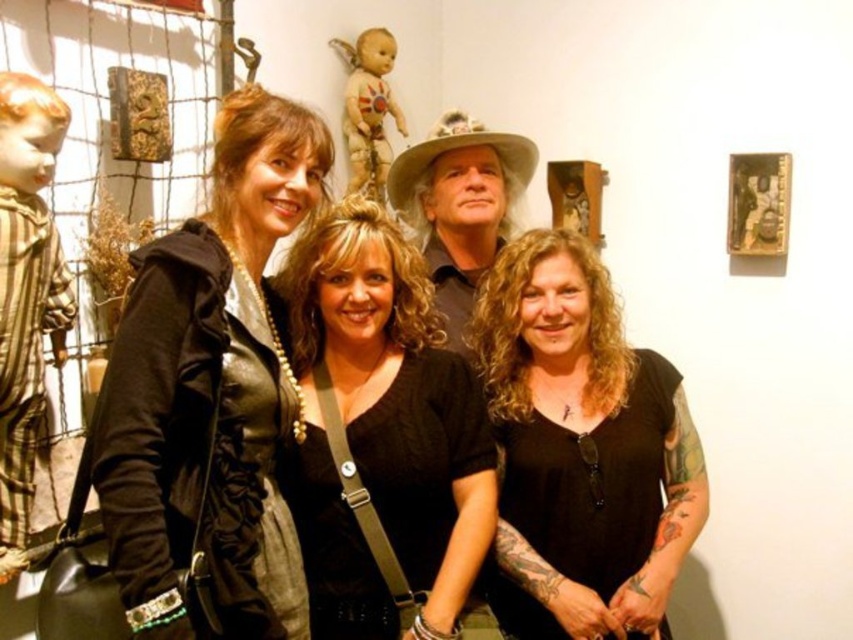
You are standing in the gallery and want to take a photo of the striped fabric doll at left without including any of the sculptures in the background. Based on its position, can you determine if this is possible?

The striped fabric doll at left is located at point [26,292] which places it near the edge of the frame. By positioning yourself to focus on this area, you can likely exclude the sculptures in the background from the photo.

You are standing in the gallery and want to take a photo of both the leather jacket at center and the matte black cowboy hat at center. Which object should you focus on first if you want to capture them both in the frame without moving the camera?

Since the leather jacket at center is positioned on the left side of the matte black cowboy hat at center, you should focus on the leather jacket at center first to ensure both are in the frame without moving the camera.

Based on the scene description, where is the leather jacket at center located in terms of its 2D coordinates?

The leather jacket at center is located at the 2D coordinates of point (212, 390).